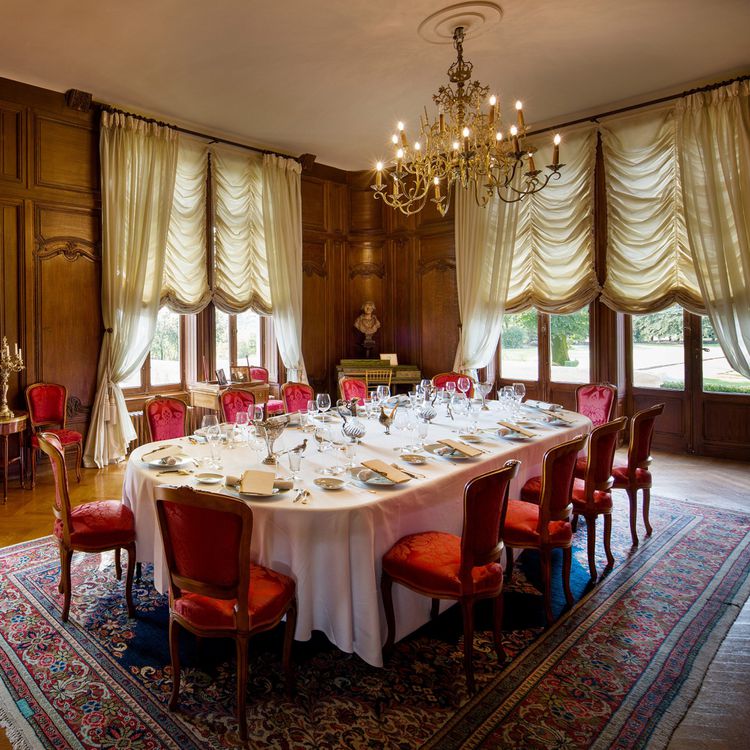
Find the location of a particular element. chair is located at coordinates (456, 556).